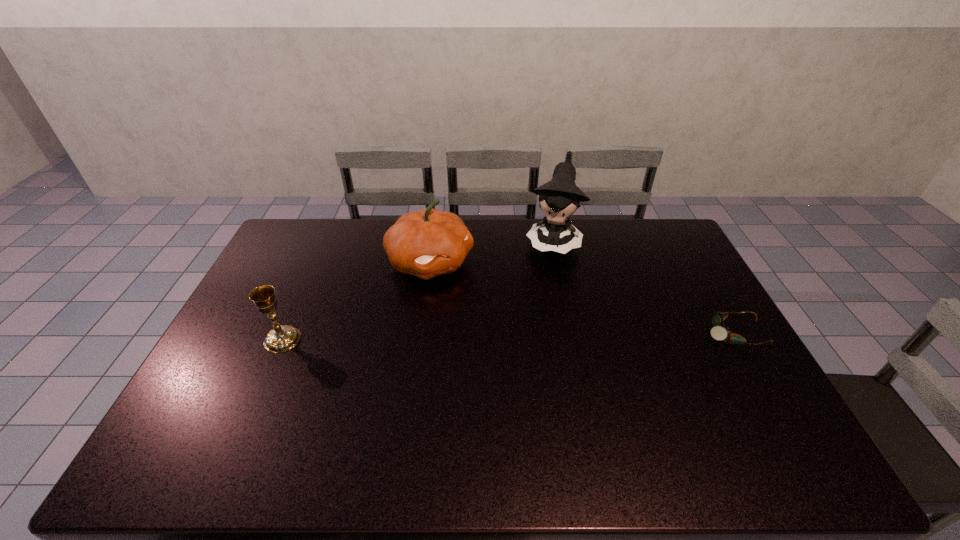
The image size is (960, 540). I want to click on the second shortest object, so click(282, 338).

I want to click on chalice, so click(x=282, y=338).

I want to click on spectacles, so click(x=719, y=333).

At what (x,y) coordinates should I click in order to perform the action: click on the rightmost object. Please return your answer as a coordinate pair (x, y). This screenshot has width=960, height=540. Looking at the image, I should click on (719, 333).

You are a GUI agent. You are given a task and a screenshot of the screen. Output one action in this format:
    pyautogui.click(x=<x>, y=<y>)
    Task: Click on the pumpkin
    The height and width of the screenshot is (540, 960).
    Given the screenshot: What is the action you would take?
    pyautogui.click(x=428, y=243)

You are a GUI agent. You are given a task and a screenshot of the screen. Output one action in this format:
    pyautogui.click(x=<x>, y=<y>)
    Task: Click on the second object from left to right
    The image size is (960, 540).
    Given the screenshot: What is the action you would take?
    pyautogui.click(x=428, y=243)

The width and height of the screenshot is (960, 540). What are the coordinates of `the second object from right to left` in the screenshot? It's located at (560, 197).

The image size is (960, 540). What are the coordinates of `the tallest object` in the screenshot? It's located at (560, 197).

The image size is (960, 540). In order to click on vacant region located 0.260m on the right of the chalice in this screenshot , I will do `click(388, 340)`.

Identify the location of vacant space located on the front face of the third shortest object. (475, 292).